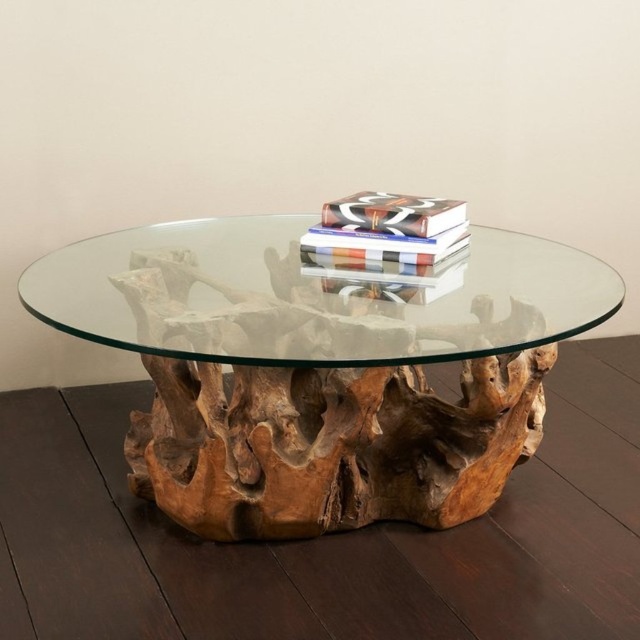
Does natural wood root table at center appear under transparent glass table at center?

Yes.

Who is more distant from viewer, (253,448) or (189,285)?

The point (253,448) is more distant.

Find the location of a particular element. This screenshot has width=640, height=640. natural wood root table at center is located at coordinates (320, 371).

The image size is (640, 640). I want to click on natural wood root table at center, so click(320, 371).

In the scene shown: Is brown wood tree trunk at center to the left of multicolored paper book at center from the viewer's perspective?

Indeed, brown wood tree trunk at center is positioned on the left side of multicolored paper book at center.

Who is taller, brown wood tree trunk at center or multicolored paper book at center?

brown wood tree trunk at center is taller.

Which is behind, point (358, 476) or point (358, 241)?

Positioned behind is point (358, 476).

Identify the location of brown wood tree trunk at center. This screenshot has height=640, width=640. (330, 444).

Does transparent glass table at center have a larger size compared to matte black book at center?

Yes, transparent glass table at center is bigger than matte black book at center.

Does point (157, 326) lie behind point (456, 205)?

No, it is not.

Locate an element on the screen. This screenshot has height=640, width=640. transparent glass table at center is located at coordinates click(310, 296).